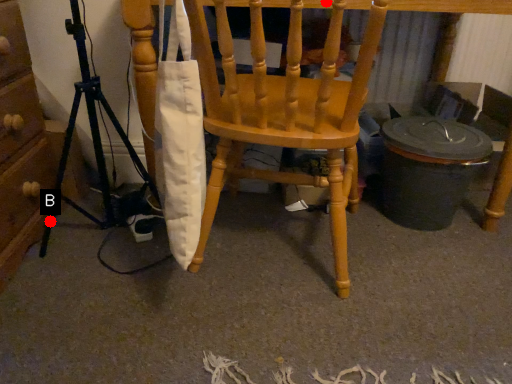
Question: Two points are circled on the image, labeled by A and B beside each circle. Among these points, which one is nearest to the camera?

Choices:
 (A) A is closer
 (B) B is closer

Answer: (A)